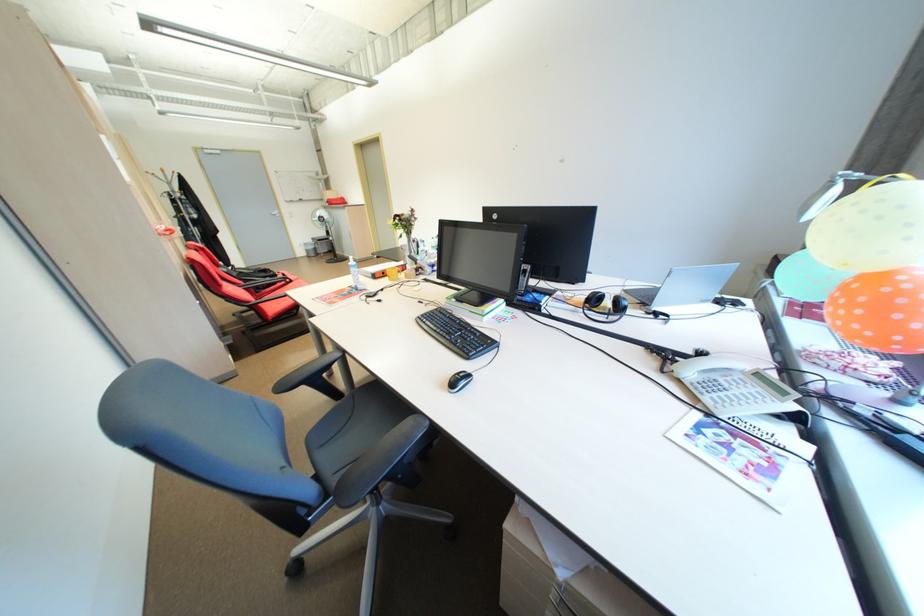
This screenshot has width=924, height=616. Describe the element at coordinates (715, 366) in the screenshot. I see `a telephone handset` at that location.